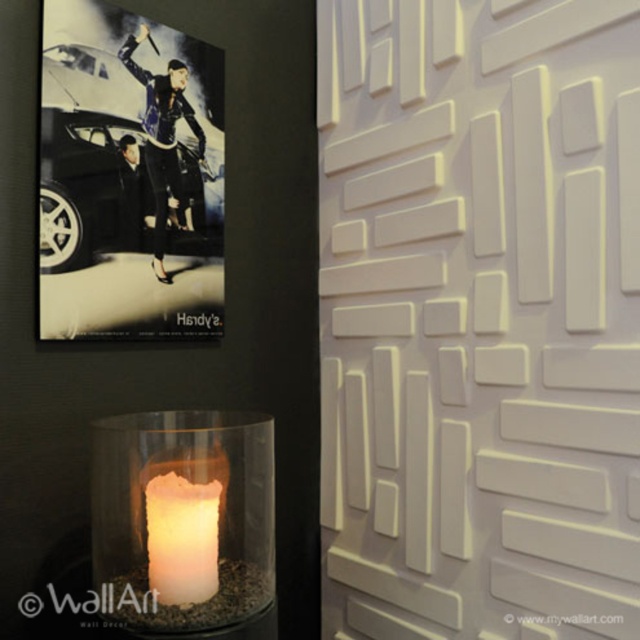
Does transparent glass candle at lower left have a greater height compared to ivory matte candle at lower left?

Yes, transparent glass candle at lower left is taller than ivory matte candle at lower left.

Does transparent glass candle at lower left appear on the left side of ivory matte candle at lower left?

Yes, transparent glass candle at lower left is to the left of ivory matte candle at lower left.

Which is behind, point (108, 596) or point (204, 486)?

The point (108, 596) is behind.

At what (x,y) coordinates should I click in order to perform the action: click on transparent glass candle at lower left. Please return your answer as a coordinate pair (x, y). The image size is (640, 640). Looking at the image, I should click on (182, 518).

Is metallic poster at upper left above transparent glass candle at lower left?

Yes, metallic poster at upper left is above transparent glass candle at lower left.

Consider the image. Is metallic poster at upper left to the left of transparent glass candle at lower left from the viewer's perspective?

Correct, you'll find metallic poster at upper left to the left of transparent glass candle at lower left.

I want to click on metallic poster at upper left, so click(x=129, y=177).

Does black glossy car at upper left appear on the left side of ivory matte candle at lower left?

Indeed, black glossy car at upper left is positioned on the left side of ivory matte candle at lower left.

Is point (45, 154) positioned before point (179, 595)?

No.

I want to click on black glossy car at upper left, so pos(92,188).